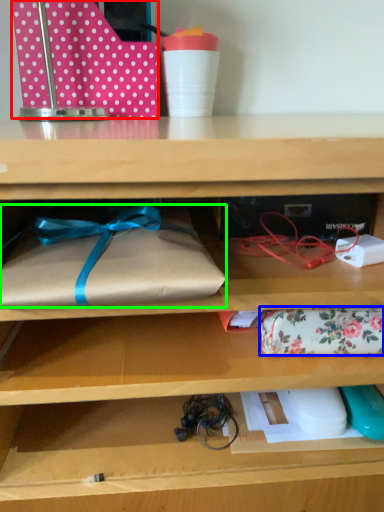
Question: Estimate the real-world distances between objects in this image. Which object is closer to wrapping paper (highlighted by a red box), wrap (highlighted by a blue box) or wrap (highlighted by a green box)?

Choices:
 (A) wrap
 (B) wrap

Answer: (B)